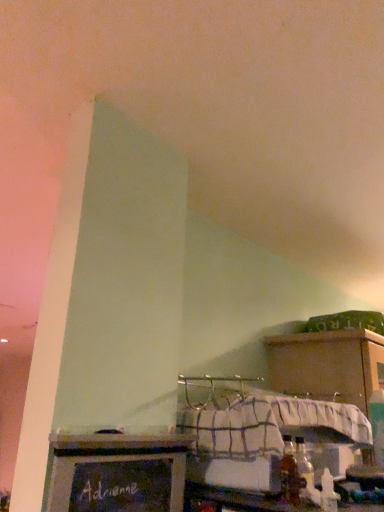
Consider the image. In order to face wooden at upper right, should I rotate leftwards or rightwards?

It's best to rotate right around 24.819 degrees.

I want to click on wooden at upper right, so click(327, 365).

What do you see at coordinates (327, 365) in the screenshot? This screenshot has height=512, width=384. I see `wooden at upper right` at bounding box center [327, 365].

Describe the element at coordinates (114, 470) in the screenshot. I see `chalkboard sign at lower center` at that location.

Identify the location of chalkboard sign at lower center. Image resolution: width=384 pixels, height=512 pixels. (114, 470).

In order to click on wooden at upper right in this screenshot , I will do `click(327, 365)`.

Does wooden at upper right appear on the right side of chalkboard sign at lower center?

Indeed, wooden at upper right is positioned on the right side of chalkboard sign at lower center.

Which is in front, wooden at upper right or chalkboard sign at lower center?

Positioned in front is chalkboard sign at lower center.

Which is behind, point (368, 359) or point (69, 500)?

The point (368, 359) is more distant.

From the image's perspective, which is above, wooden at upper right or chalkboard sign at lower center?

chalkboard sign at lower center appears higher in the image.

From a real-world perspective, relative to chalkboard sign at lower center, is wooden at upper right vertically above or below?

wooden at upper right is above chalkboard sign at lower center.

Which of these two, wooden at upper right or chalkboard sign at lower center, is thinner?

chalkboard sign at lower center.

In terms of height, does wooden at upper right look taller or shorter compared to chalkboard sign at lower center?

In the image, wooden at upper right appears to be taller than chalkboard sign at lower center.

Considering the sizes of wooden at upper right and chalkboard sign at lower center in the image, is wooden at upper right bigger or smaller than chalkboard sign at lower center?

wooden at upper right is bigger than chalkboard sign at lower center.

Is wooden at upper right situated inside chalkboard sign at lower center or outside?

The correct answer is: outside.

Is wooden at upper right positioned far away from chalkboard sign at lower center?

No, wooden at upper right is in close proximity to chalkboard sign at lower center.

Is wooden at upper right facing towards chalkboard sign at lower center?

No, wooden at upper right is not facing towards chalkboard sign at lower center.

What's the angular difference between wooden at upper right and chalkboard sign at lower center's facing directions?

0.0874 degrees.

Identify the location of furniture in front of the wooden at upper right. The height and width of the screenshot is (512, 384). (114, 470).

Considering the relative positions of chalkboard sign at lower center and wooden at upper right in the image provided, is chalkboard sign at lower center to the left or to the right of wooden at upper right?

In the image, chalkboard sign at lower center appears on the left side of wooden at upper right.

In the image, is chalkboard sign at lower center positioned in front of or behind wooden at upper right?

Visually, chalkboard sign at lower center is located in front of wooden at upper right.

Is point (114, 476) positioned after point (272, 359)?

That is False.

From the image's perspective, is chalkboard sign at lower center located beneath wooden at upper right?

Incorrect, from the image's perspective, chalkboard sign at lower center is higher than wooden at upper right.

From a real-world perspective, who is located lower, chalkboard sign at lower center or wooden at upper right?

From a 3D spatial view, chalkboard sign at lower center is below.

Which object is wider, chalkboard sign at lower center or wooden at upper right?

wooden at upper right.

Considering the relative sizes of chalkboard sign at lower center and wooden at upper right in the image provided, is chalkboard sign at lower center taller than wooden at upper right?

Incorrect, the height of chalkboard sign at lower center is not larger of that of wooden at upper right.

Does chalkboard sign at lower center have a smaller size compared to wooden at upper right?

Indeed, chalkboard sign at lower center has a smaller size compared to wooden at upper right.

Is chalkboard sign at lower center outside of wooden at upper right?

Indeed, chalkboard sign at lower center is completely outside wooden at upper right.

Is there a large distance between chalkboard sign at lower center and wooden at upper right?

Actually, chalkboard sign at lower center and wooden at upper right are a little close together.

Is chalkboard sign at lower center facing away from wooden at upper right?

No, chalkboard sign at lower center's orientation is not away from wooden at upper right.

Measure the distance from chalkboard sign at lower center to wooden at upper right.

chalkboard sign at lower center and wooden at upper right are 24.80 inches apart.

Where is `furniture above the wooden at upper right (from the image's perspective)`? This screenshot has width=384, height=512. furniture above the wooden at upper right (from the image's perspective) is located at coordinates (114, 470).

This screenshot has height=512, width=384. What are the coordinates of `furniture directly beneath the wooden at upper right (from a real-world perspective)` in the screenshot? It's located at (114, 470).

This screenshot has width=384, height=512. I want to click on furniture on the left of wooden at upper right, so click(x=114, y=470).